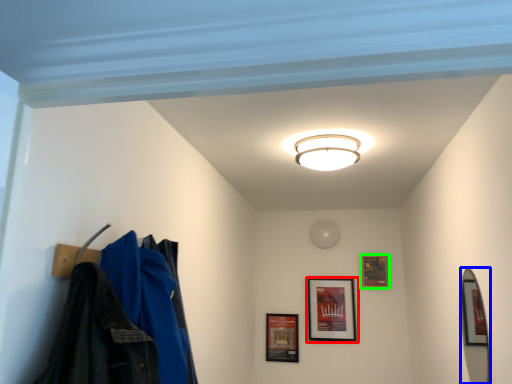
Question: Which object is positioned farthest from picture frame (highlighted by a red box)? Select from mirror (highlighted by a blue box) and picture frame (highlighted by a green box).

Choices:
 (A) mirror
 (B) picture frame

Answer: (A)